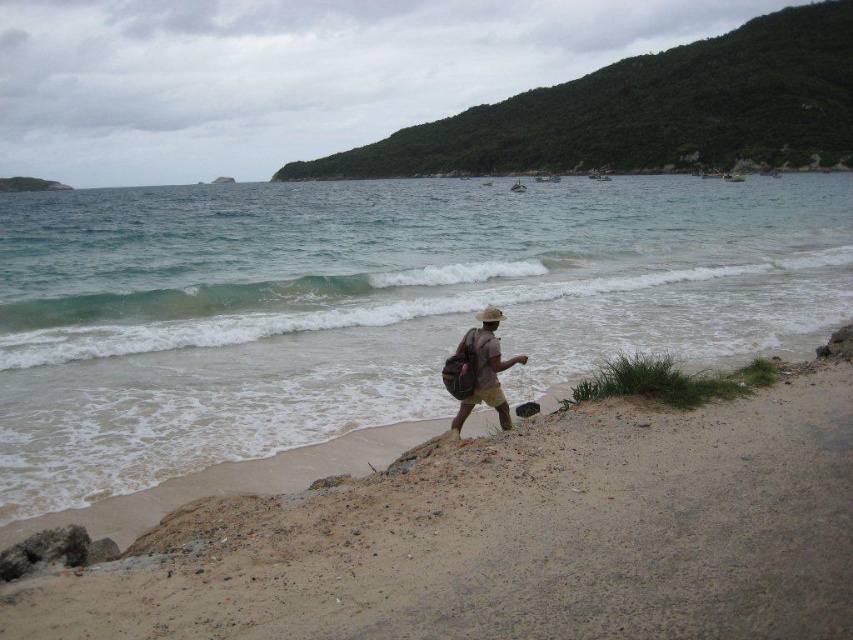
You are planning to cross the brown sandy beach at lower center to reach the clear blue water at center. Based on the scene, which area is wider?

The clear blue water at center is wider than the brown sandy beach at lower center according to the description.

You are standing at the point marked as point (x=368, y=305) and want to find the nearest clear blue water. According to the scene description, where is the nearest clear blue water located?

The nearest clear blue water is located at center, as the description states that at point (x=368, y=305) lies clear blue water at center.

You are standing at point [433,221] and want to reach the water. The distance between you and the water is 42.66 meters. Can you walk straight to the water without obstacles?

Yes, since the distance between point [433,221] and the water is 42.66 meters, you can walk straight to the water as there are no obstacles mentioned in the scene description.